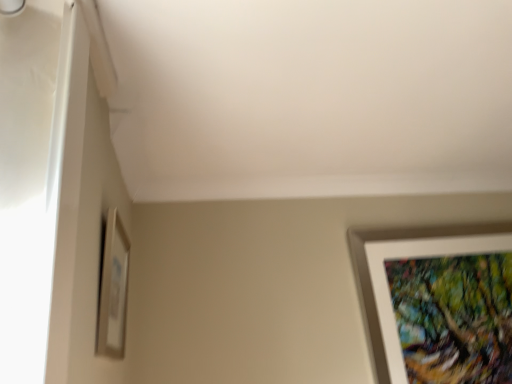
Question: From a real-world perspective, relative to white matte picture frame at lower right, the 1th picture frame when ordered from right to left, is matte white picture frame at lower left, which is the first picture frame in left-to-right order, vertically above or below?

Choices:
 (A) below
 (B) above

Answer: (B)

Question: From the image's perspective, is matte white picture frame at lower left, the first picture frame positioned from the front, above or below white matte picture frame at lower right, the 1th picture frame when ordered from right to left?

Choices:
 (A) above
 (B) below

Answer: (A)

Question: Considering the positions of matte white picture frame at lower left, which is the first picture frame in left-to-right order, and white matte picture frame at lower right, which ranks as the 1th picture frame in back-to-front order, in the image, is matte white picture frame at lower left, which is the first picture frame in left-to-right order, taller or shorter than white matte picture frame at lower right, which ranks as the 1th picture frame in back-to-front order,?

Choices:
 (A) tall
 (B) short

Answer: (B)

Question: Is white matte picture frame at lower right, which is counted as the second picture frame, starting from the left, in front of or behind matte white picture frame at lower left, which is the first picture frame in left-to-right order, in the image?

Choices:
 (A) behind
 (B) front

Answer: (A)

Question: Does point (451, 226) appear closer or farther from the camera than point (126, 279)?

Choices:
 (A) closer
 (B) farther

Answer: (B)

Question: Considering the relative positions of white matte picture frame at lower right, which ranks as the 1th picture frame in back-to-front order, and matte white picture frame at lower left, which is the first picture frame in left-to-right order, in the image provided, is white matte picture frame at lower right, which ranks as the 1th picture frame in back-to-front order, to the left or to the right of matte white picture frame at lower left, which is the first picture frame in left-to-right order,?

Choices:
 (A) right
 (B) left

Answer: (A)

Question: From their relative heights in the image, would you say white matte picture frame at lower right, which is counted as the second picture frame, starting from the left, is taller or shorter than matte white picture frame at lower left, which is the first picture frame in left-to-right order?

Choices:
 (A) tall
 (B) short

Answer: (A)